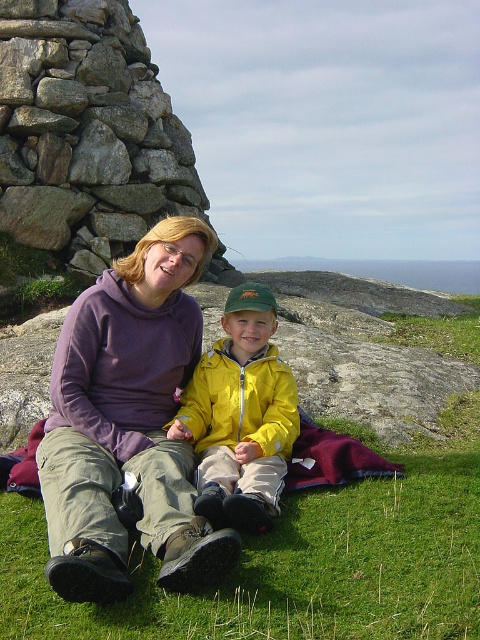
Question: From the image, what is the correct spatial relationship of yellow matte jacket at center in relation to maroon fabric blanket at lower center?

Choices:
 (A) left
 (B) right

Answer: (A)

Question: Among these points, which one is farthest from the camera?

Choices:
 (A) (145, 237)
 (B) (290, 486)

Answer: (A)

Question: Does green grass at lower center appear on the right side of rustic stone cairn at left?

Choices:
 (A) no
 (B) yes

Answer: (B)

Question: Which of the following is the closest to the observer?

Choices:
 (A) (423, 611)
 (B) (80, 417)
 (C) (337, 433)
 (D) (239, 480)

Answer: (A)

Question: Does rustic stone cairn at left have a larger size compared to yellow matte jacket at center?

Choices:
 (A) yes
 (B) no

Answer: (B)

Question: Among these objects, which one is nearest to the camera?

Choices:
 (A) maroon fabric blanket at lower center
 (B) rustic stone cairn at left
 (C) yellow matte jacket at center
 (D) green grass at lower center

Answer: (C)